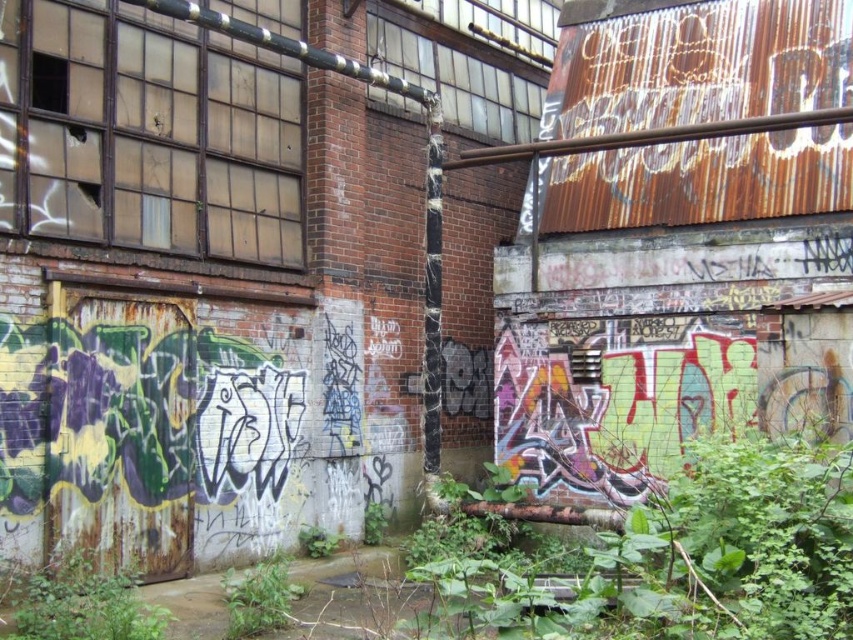
You are a botanist examining the green leafy plant at lower left and the green leafy plant at lower center in the image. Which plant is bigger?

The green leafy plant at lower left is larger in size compared to the green leafy plant at lower center.